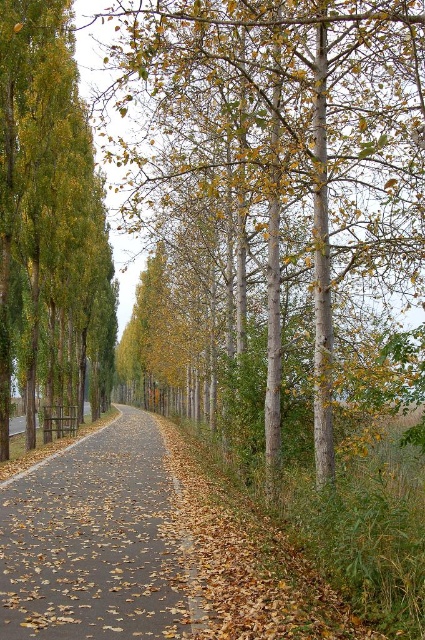
Between green glossy tree at left and brown asphalt path at center, which one appears on the right side from the viewer's perspective?

From the viewer's perspective, brown asphalt path at center appears more on the right side.

Who is more forward, (34, 362) or (104, 465)?

Point (104, 465) is more forward.

Is point (5, 234) positioned in front of point (70, 449)?

No, (5, 234) is behind (70, 449).

Identify the location of green glossy tree at left. Image resolution: width=425 pixels, height=640 pixels. (50, 225).

Who is higher up, smooth gray tree at center or brown asphalt path at center?

smooth gray tree at center is above.

Between point (246, 209) and point (84, 547), which one is positioned behind?

Point (246, 209)

Identify the location of smooth gray tree at center. The image size is (425, 640). (282, 148).

The height and width of the screenshot is (640, 425). Find the location of `smooth gray tree at center`. smooth gray tree at center is located at coordinates (282, 148).

Identify the location of smooth gray tree at center. This screenshot has width=425, height=640. (282, 148).